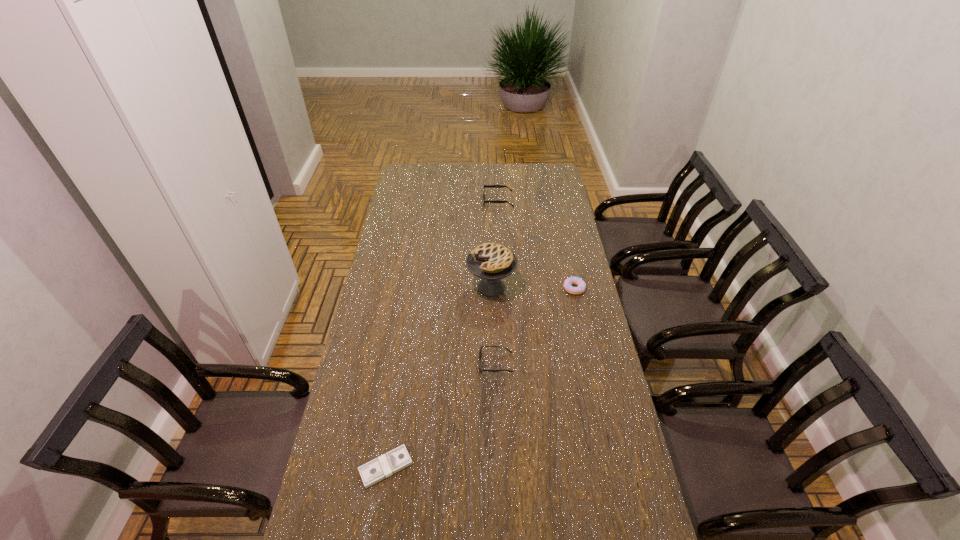
Where is `free spot located on the cut side of the tallest object`? The width and height of the screenshot is (960, 540). free spot located on the cut side of the tallest object is located at coordinates click(390, 287).

This screenshot has width=960, height=540. In order to click on free spot located at the front lenses of the farthest object in this screenshot , I will do `click(460, 201)`.

Locate an element on the screen. blank area located 0.210m at the front lenses of the farthest object is located at coordinates point(442,201).

The height and width of the screenshot is (540, 960). I want to click on free space located 0.400m at the front lenses of the farthest object, so click(x=405, y=201).

Locate an element on the screen. The width and height of the screenshot is (960, 540). vacant space situated 0.080m on the front of the rightmost object is located at coordinates (579, 311).

Find the location of a particular element. blank space located on the front-facing side of the nearer sunglasses is located at coordinates (408, 363).

What are the coordinates of `vacant space located on the front-facing side of the nearer sunglasses` in the screenshot? It's located at (388, 363).

I want to click on vacant region located on the front-facing side of the nearer sunglasses, so click(x=362, y=363).

Locate an element on the screen. This screenshot has height=540, width=960. vacant space located on the front of the leftmost object is located at coordinates (379, 508).

At what (x,y) coordinates should I click in order to perform the action: click on object that is at the left edge. Please return your answer as a coordinate pair (x, y). Looking at the image, I should click on (397, 459).